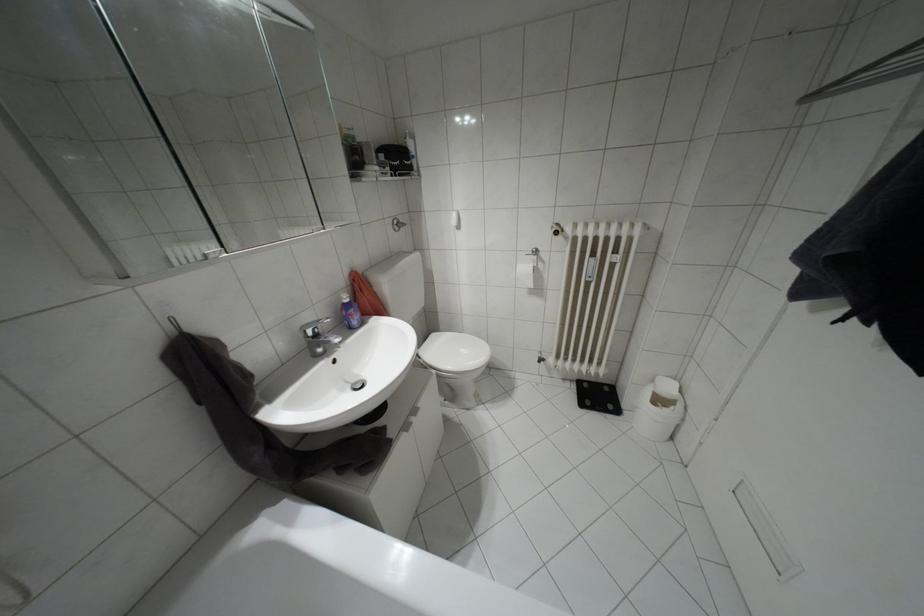
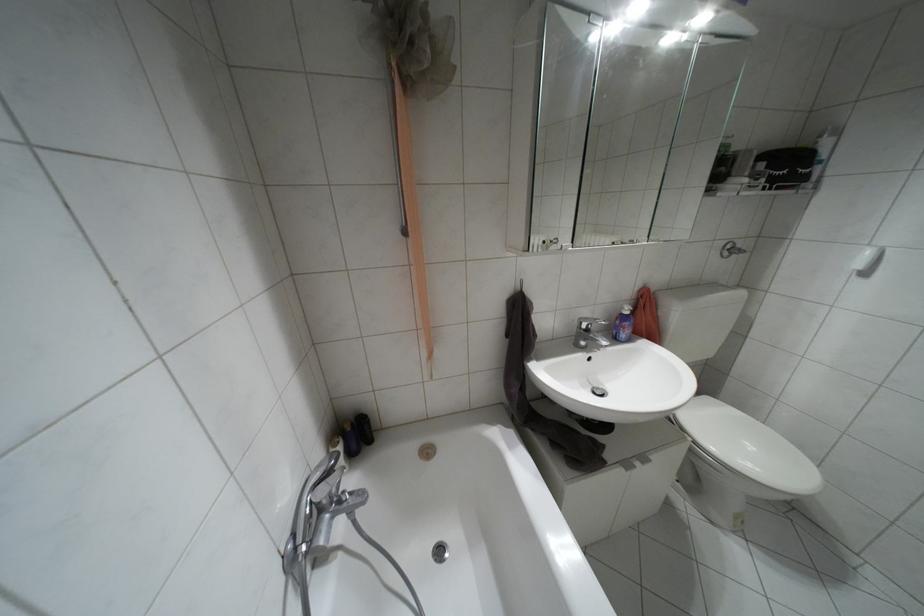
The point at (432, 334) is marked in the first image. Where is the corresponding point in the second image?

(706, 398)